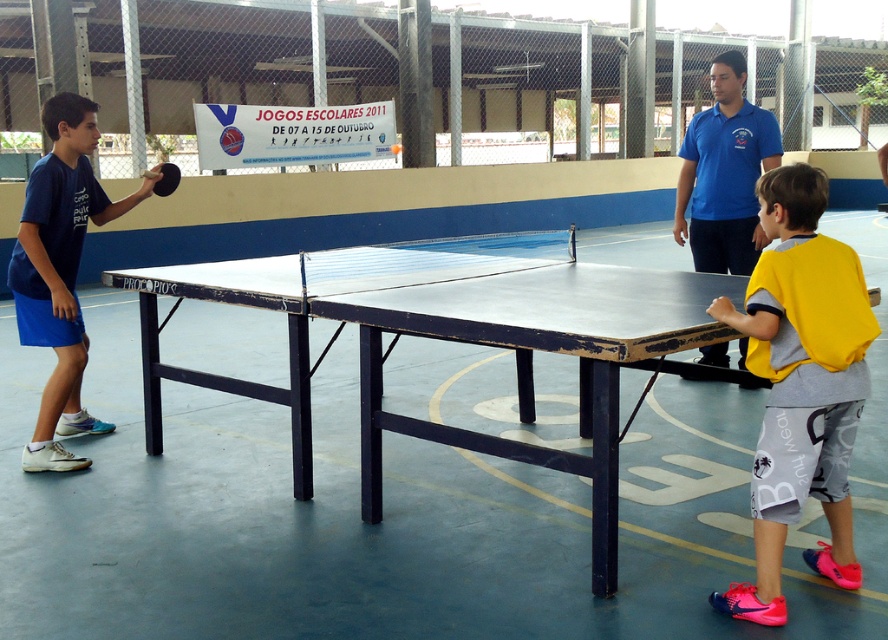
You are standing at the position of the yellow jersey at right. The table tennis table is 2.74 meters long. Can you reach the end of the table from your current position?

The yellow jersey at right and viewer are 3.92 meters apart from each other. The table tennis table is 2.74 meters long. Since the distance between you and the yellow jersey at right is greater than the table length, you cannot reach the end of the table from your current position.

You are a referee at a childrens table tennis tournament. You need to ensure that the players are wearing appropriate attire. The rules state that the jersey must be longer than the shorts. Based on the image provided, does the yellow jersey at right meet the requirement compared to the matte blue shorts at left?

The yellow jersey at right is shorter than the matte blue shorts at left, so it does not meet the requirement since the jersey must be longer than the shorts according to the rules.